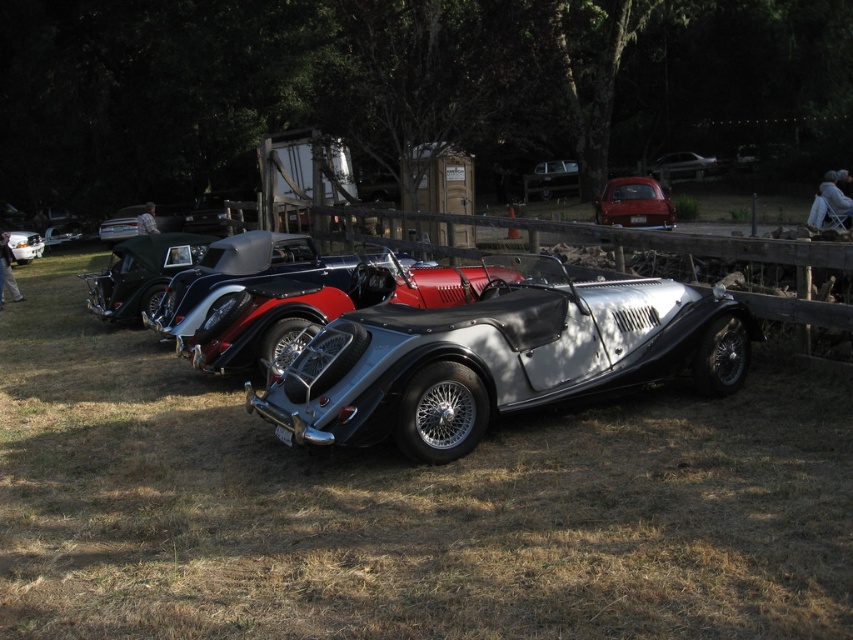
You are a photographer planning to take a photo of the metallic red car at center and the metallic silver convertible at upper right. To ensure both are in frame, which car should you position closer to the center of your camera viewfinder?

The metallic red car at center should be positioned closer to the center of your camera viewfinder since it is already on the left side of the metallic silver convertible at upper right, so centering it would help include both in the frame.

You are a photographer standing at the edge of the grassy area where the vintage cars are parked. You want to take a photo of the metallic red car at center from a distance of 20 meters. Can you position yourself exactly 20 meters away to capture the shot?

The metallic red car at center and viewer are 19.80 meters apart, so you can position yourself exactly 20 meters away to capture the shot since the distance is nearly 20 meters.